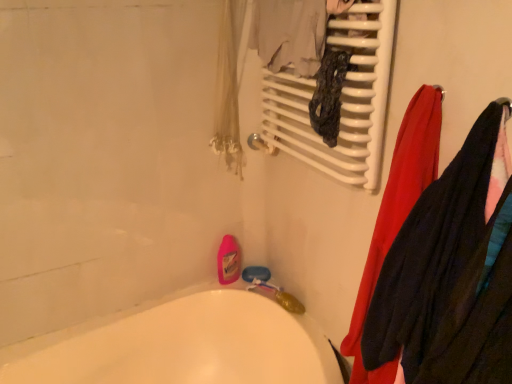
What is the approximate height of white glossy radiator at upper center?

19.62 inches.

Where is `white glossy bathtub at lower left`? Image resolution: width=512 pixels, height=384 pixels. white glossy bathtub at lower left is located at coordinates click(181, 345).

The image size is (512, 384). Identify the location of velvet-like black sweater at right, placed as the second clothing when sorted from left to right. (452, 271).

At what (x,y) coordinates should I click in order to perform the action: click on white glossy radiator at upper center. Please return your answer as a coordinate pair (x, y). Looking at the image, I should click on [x=341, y=98].

Is velvet-like black sweater at right, which is the 1th clothing in right-to-left order, thinner than red fabric towel at right, the 1th clothing in the left-to-right sequence?

Indeed, velvet-like black sweater at right, which is the 1th clothing in right-to-left order, has a lesser width compared to red fabric towel at right, the 1th clothing in the left-to-right sequence.

From the image's perspective, is velvet-like black sweater at right, placed as the second clothing when sorted from left to right, under red fabric towel at right, the 1th clothing in the left-to-right sequence?

No.

Is point (477, 135) closer or farther from the camera than point (391, 173)?

Point (477, 135) is closer to the camera than point (391, 173).

What's the angular difference between velvet-like black sweater at right, which is the 1th clothing in right-to-left order, and red fabric towel at right, the 2th clothing when ordered from right to left,'s facing directions?

The angle between the facing direction of velvet-like black sweater at right, which is the 1th clothing in right-to-left order, and the facing direction of red fabric towel at right, the 2th clothing when ordered from right to left, is 0.000375 degrees.

Can you confirm if white glossy radiator at upper center is thinner than red fabric towel at right, the 1th clothing in the left-to-right sequence?

Yes.

Considering the positions of objects white glossy radiator at upper center and red fabric towel at right, the 2th clothing when ordered from right to left, in the image provided, who is more to the left, white glossy radiator at upper center or red fabric towel at right, the 2th clothing when ordered from right to left,?

Positioned to the left is white glossy radiator at upper center.

Is white glossy radiator at upper center taller or shorter than red fabric towel at right, the 1th clothing in the left-to-right sequence?

Clearly, white glossy radiator at upper center is shorter compared to red fabric towel at right, the 1th clothing in the left-to-right sequence.

How distant is red fabric towel at right, the 1th clothing in the left-to-right sequence, from velvet-like black sweater at right, which is the 1th clothing in right-to-left order?

The distance of red fabric towel at right, the 1th clothing in the left-to-right sequence, from velvet-like black sweater at right, which is the 1th clothing in right-to-left order, is 5.51 inches.

Is velvet-like black sweater at right, placed as the second clothing when sorted from left to right, located within red fabric towel at right, the 2th clothing when ordered from right to left?

Yes, red fabric towel at right, the 2th clothing when ordered from right to left, contains velvet-like black sweater at right, placed as the second clothing when sorted from left to right.

Does red fabric towel at right, the 1th clothing in the left-to-right sequence, touch velvet-like black sweater at right, which is the 1th clothing in right-to-left order?

No, red fabric towel at right, the 1th clothing in the left-to-right sequence, is not beside velvet-like black sweater at right, which is the 1th clothing in right-to-left order.

Considering the relative sizes of red fabric towel at right, the 2th clothing when ordered from right to left, and velvet-like black sweater at right, which is the 1th clothing in right-to-left order, in the image provided, is red fabric towel at right, the 2th clothing when ordered from right to left, bigger than velvet-like black sweater at right, which is the 1th clothing in right-to-left order,?

Indeed, red fabric towel at right, the 2th clothing when ordered from right to left, has a larger size compared to velvet-like black sweater at right, which is the 1th clothing in right-to-left order.

From a real-world perspective, is velvet-like black sweater at right, which is the 1th clothing in right-to-left order, physically above white glossy bathtub at lower left?

Indeed, from a real-world perspective, velvet-like black sweater at right, which is the 1th clothing in right-to-left order, stands above white glossy bathtub at lower left.

Which object is further away from the camera taking this photo, velvet-like black sweater at right, placed as the second clothing when sorted from left to right, or white glossy bathtub at lower left?

white glossy bathtub at lower left.

From the image's perspective, relative to white glossy bathtub at lower left, is velvet-like black sweater at right, which is the 1th clothing in right-to-left order, above or below?

Based on their image positions, velvet-like black sweater at right, which is the 1th clothing in right-to-left order, is located above white glossy bathtub at lower left.

Can you confirm if velvet-like black sweater at right, which is the 1th clothing in right-to-left order, is smaller than white glossy bathtub at lower left?

Indeed, velvet-like black sweater at right, which is the 1th clothing in right-to-left order, has a smaller size compared to white glossy bathtub at lower left.

Is white glossy radiator at upper center in front of or behind velvet-like black sweater at right, which is the 1th clothing in right-to-left order, in the image?

In the image, white glossy radiator at upper center appears behind velvet-like black sweater at right, which is the 1th clothing in right-to-left order.

From a real-world perspective, is white glossy radiator at upper center on velvet-like black sweater at right, placed as the second clothing when sorted from left to right?

Correct, in the physical world, white glossy radiator at upper center is higher than velvet-like black sweater at right, placed as the second clothing when sorted from left to right.

Is velvet-like black sweater at right, placed as the second clothing when sorted from left to right, at the back of white glossy radiator at upper center?

No.

From the image's perspective, is white glossy radiator at upper center on velvet-like black sweater at right, placed as the second clothing when sorted from left to right?

Correct, white glossy radiator at upper center appears higher than velvet-like black sweater at right, placed as the second clothing when sorted from left to right, in the image.

Relative to white glossy radiator at upper center, is velvet-like black sweater at right, which is the 1th clothing in right-to-left order, in front or behind?

Clearly, velvet-like black sweater at right, which is the 1th clothing in right-to-left order, is in front of white glossy radiator at upper center.

From the image's perspective, is velvet-like black sweater at right, which is the 1th clothing in right-to-left order, below white glossy radiator at upper center?

Result: Correct, velvet-like black sweater at right, which is the 1th clothing in right-to-left order, appears lower than white glossy radiator at upper center in the image.

Is velvet-like black sweater at right, which is the 1th clothing in right-to-left order, bigger than white glossy radiator at upper center?

Correct, velvet-like black sweater at right, which is the 1th clothing in right-to-left order, is larger in size than white glossy radiator at upper center.

From the picture: Considering the sizes of objects velvet-like black sweater at right, placed as the second clothing when sorted from left to right, and white glossy radiator at upper center in the image provided, who is thinner, velvet-like black sweater at right, placed as the second clothing when sorted from left to right, or white glossy radiator at upper center?

white glossy radiator at upper center is thinner.

From the image's perspective, which one is positioned higher, white glossy bathtub at lower left or white glossy radiator at upper center?

white glossy radiator at upper center, from the image's perspective.

Is white glossy bathtub at lower left not near white glossy radiator at upper center?

No, there isn't a large distance between white glossy bathtub at lower left and white glossy radiator at upper center.

Does point (240, 309) appear closer or farther from the camera than point (289, 82)?

Point (240, 309) appears to be farther away from the viewer than point (289, 82).

From a real-world perspective, which object stands above the other?

From a 3D spatial view, white glossy radiator at upper center is above.

Where is `clothing that is above the red fabric towel at right, the 2th clothing when ordered from right to left (from the image's perspective)`? Image resolution: width=512 pixels, height=384 pixels. clothing that is above the red fabric towel at right, the 2th clothing when ordered from right to left (from the image's perspective) is located at coordinates (452, 271).

At what (x,y) coordinates should I click in order to perform the action: click on radiator lying behind the red fabric towel at right, the 2th clothing when ordered from right to left. Please return your answer as a coordinate pair (x, y). Looking at the image, I should click on (341, 98).

When comparing their distances from velvet-like black sweater at right, placed as the second clothing when sorted from left to right, does white glossy radiator at upper center or red fabric towel at right, the 1th clothing in the left-to-right sequence, seem closer?

red fabric towel at right, the 1th clothing in the left-to-right sequence, is closer to velvet-like black sweater at right, placed as the second clothing when sorted from left to right.

Considering their positions, is red fabric towel at right, the 1th clothing in the left-to-right sequence, positioned closer to white glossy bathtub at lower left than white glossy radiator at upper center?

red fabric towel at right, the 1th clothing in the left-to-right sequence.

Estimate the real-world distances between objects in this image. Which object is further from velvet-like black sweater at right, placed as the second clothing when sorted from left to right, white glossy bathtub at lower left or red fabric towel at right, the 1th clothing in the left-to-right sequence?

Based on the image, white glossy bathtub at lower left appears to be further to velvet-like black sweater at right, placed as the second clothing when sorted from left to right.

Estimate the real-world distances between objects in this image. Which object is further from white glossy bathtub at lower left, velvet-like black sweater at right, which is the 1th clothing in right-to-left order, or white glossy radiator at upper center?

white glossy radiator at upper center is positioned further to the anchor white glossy bathtub at lower left.

From the image, which object appears to be farther from white glossy bathtub at lower left, red fabric towel at right, the 2th clothing when ordered from right to left, or velvet-like black sweater at right, placed as the second clothing when sorted from left to right?

The object further to white glossy bathtub at lower left is velvet-like black sweater at right, placed as the second clothing when sorted from left to right.

Looking at the image, which one is located further to velvet-like black sweater at right, which is the 1th clothing in right-to-left order, red fabric towel at right, the 1th clothing in the left-to-right sequence, or white glossy bathtub at lower left?

white glossy bathtub at lower left.

Considering their positions, is white glossy radiator at upper center positioned further to white glossy bathtub at lower left than velvet-like black sweater at right, placed as the second clothing when sorted from left to right?

Among the two, white glossy radiator at upper center is located further to white glossy bathtub at lower left.

Looking at the image, which one is located closer to red fabric towel at right, the 2th clothing when ordered from right to left, velvet-like black sweater at right, placed as the second clothing when sorted from left to right, or white glossy radiator at upper center?

Among the two, velvet-like black sweater at right, placed as the second clothing when sorted from left to right, is located nearer to red fabric towel at right, the 2th clothing when ordered from right to left.

Where is `clothing between velvet-like black sweater at right, placed as the second clothing when sorted from left to right, and white glossy bathtub at lower left in the up-down direction`? clothing between velvet-like black sweater at right, placed as the second clothing when sorted from left to right, and white glossy bathtub at lower left in the up-down direction is located at coordinates (397, 214).

Identify the location of clothing between white glossy radiator at upper center and red fabric towel at right, the 1th clothing in the left-to-right sequence, from top to bottom. This screenshot has height=384, width=512. (452, 271).